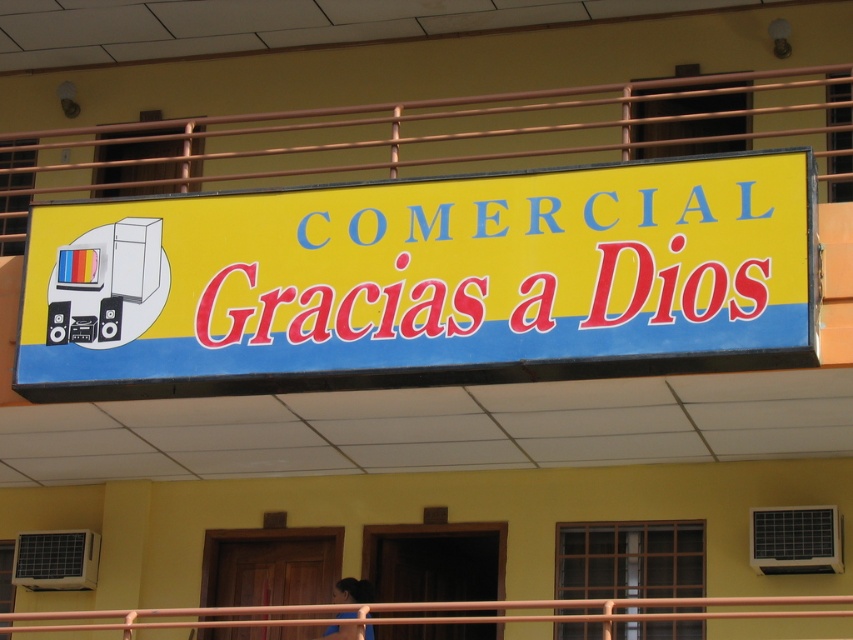
Between yellow matte signboard at center and dark brown hair at lower center, which one appears on the right side from the viewer's perspective?

From the viewer's perspective, yellow matte signboard at center appears more on the right side.

Between yellow matte signboard at center and dark brown hair at lower center, which one has less height?

Standing shorter between the two is dark brown hair at lower center.

Between point (357, 348) and point (363, 589), which one is positioned behind?

The point (363, 589) is more distant.

At what (x,y) coordinates should I click in order to perform the action: click on yellow matte signboard at center. Please return your answer as a coordinate pair (x, y). Looking at the image, I should click on (424, 282).

Between brown metal rail at center and dark brown hair at lower center, which one appears on the left side from the viewer's perspective?

Positioned to the left is dark brown hair at lower center.

Does brown metal rail at center come in front of dark brown hair at lower center?

Yes, brown metal rail at center is closer to the viewer.

Is point (160, 618) farther from viewer compared to point (370, 632)?

Yes.

Identify the location of brown metal rail at center. This screenshot has width=853, height=640. (610, 609).

Can you confirm if brown metal railing at upper center is thinner than brown metal rail at center?

Incorrect, brown metal railing at upper center's width is not less than brown metal rail at center's.

Does point (155, 176) come farther from viewer compared to point (561, 600)?

Yes, point (155, 176) is behind point (561, 600).

Where is `brown metal railing at upper center`? This screenshot has width=853, height=640. brown metal railing at upper center is located at coordinates (431, 138).